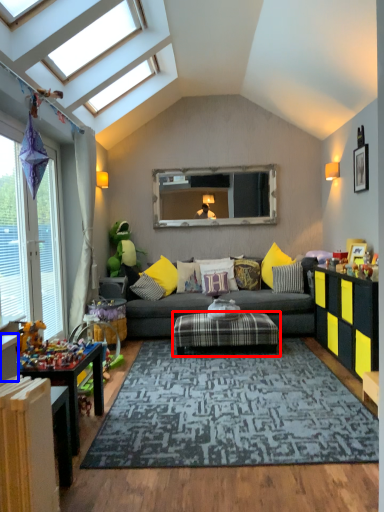
Question: Which object appears closest to the camera in this image, coffee table (highlighted by a red box) or table (highlighted by a blue box)?

Choices:
 (A) coffee table
 (B) table

Answer: (B)